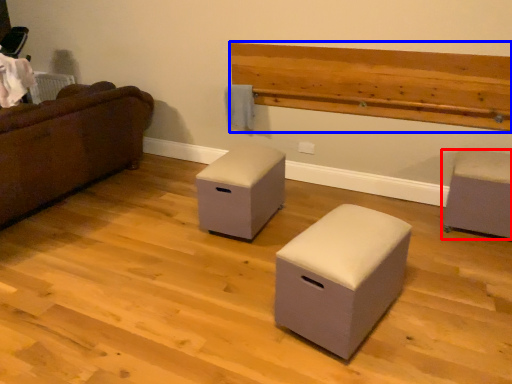
Question: Among these objects, which one is farthest to the camera, furniture (highlighted by a red box) or hardwood (highlighted by a blue box)?

Choices:
 (A) furniture
 (B) hardwood

Answer: (B)